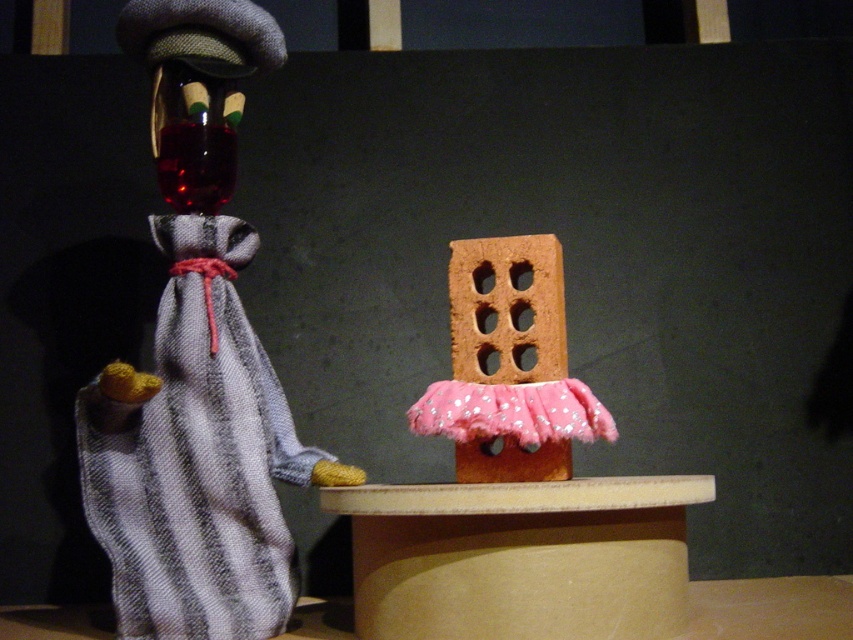
You are a small toy car that is 2 inches wide. You are positioned between the striped fabric doll at left and the pink felt brick at center. Can you drive straight through the space between them?

The distance between the striped fabric doll at left and pink felt brick at center is 8.52 inches. Since the toy car is only 2 inches wide, there is sufficient space for it to pass through the gap between them.

You are a toy collector trying to place both the striped fabric doll at left and the pink felt brick at center on a shelf. Given that the shelf has limited height, which object should you place first to ensure both fit without exceeding the height limit?

The striped fabric doll at left is much taller than the pink felt brick at center, so you should place the pink felt brick at center first to accommodate the taller doll afterward.

You are an observer standing in front of the image. You notice the striped fabric doll at left and the pink felt brick at center. Which object would appear larger to you?

The striped fabric doll at left appears larger because it is closer to the viewer than the pink felt brick at center.